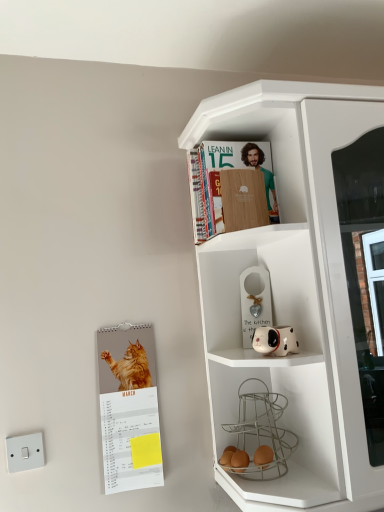
Question: Choose the correct answer: Is white plastic switch at lower left inside white glossy dog-shaped planter at middle right or outside it?

Choices:
 (A) outside
 (B) inside

Answer: (A)

Question: In terms of width, does white plastic switch at lower left look wider or thinner when compared to white glossy dog-shaped planter at middle right?

Choices:
 (A) wide
 (B) thin

Answer: (B)

Question: Based on their relative distances, which object is nearer to the wooden cover book at upper center?

Choices:
 (A) orange fur cat calendar at left
 (B) white matte cupboard at upper right
 (C) white glossy dog-shaped planter at middle right
 (D) white plastic switch at lower left

Answer: (B)

Question: Which is farther from the wooden cover book at upper center?

Choices:
 (A) white glossy dog-shaped planter at middle right
 (B) white matte cupboard at upper right
 (C) orange fur cat calendar at left
 (D) white plastic switch at lower left

Answer: (D)